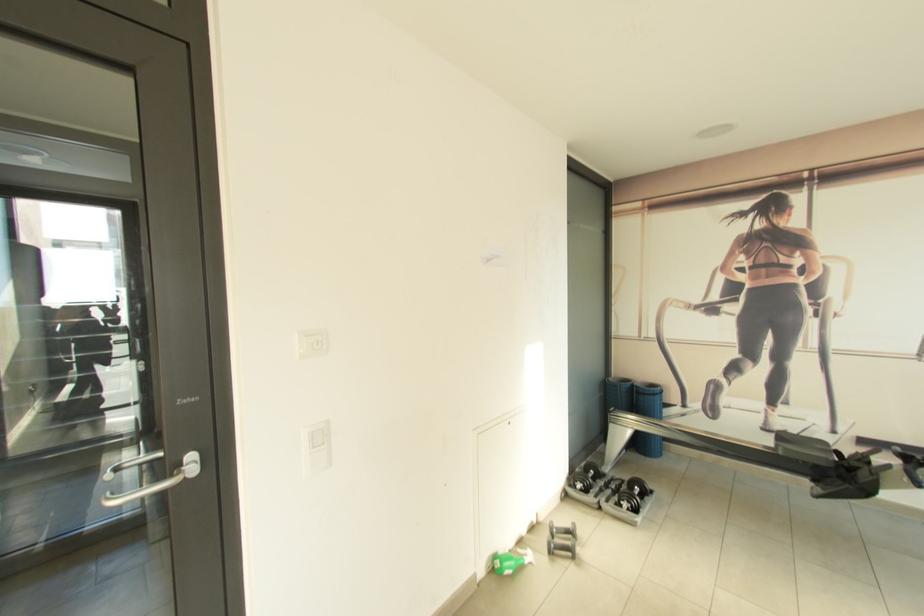
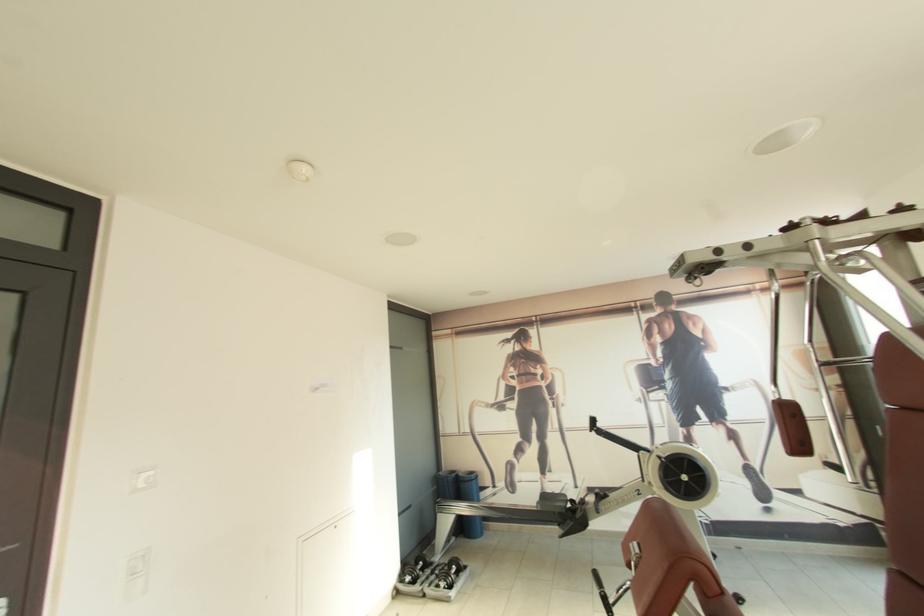
Question: The images are taken continuously from a first-person perspective. In which direction are you moving?

Choices:
 (A) Left
 (B) Right
 (C) Forward
 (D) Backward

Answer: (D)